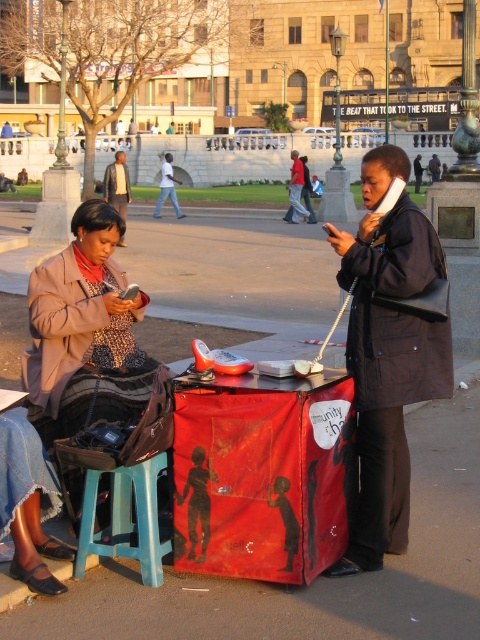
You are a tailor who needs to determine which coat requires more fabric to repair. Based on the image, which coat between the matte black coat at center and the matte brown coat at left would need more fabric for the repair?

The matte brown coat at left requires more fabric for repair since its width is greater than the matte black coat at center.